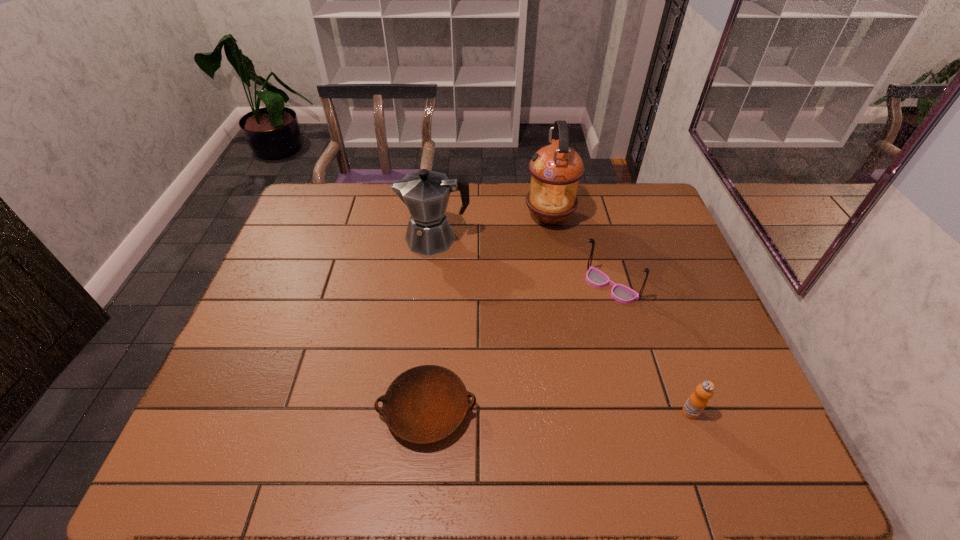
Locate an element on the screen. vacant space at the left edge is located at coordinates (294, 282).

The width and height of the screenshot is (960, 540). What are the coordinates of `free space at the right edge of the desktop` in the screenshot? It's located at (651, 275).

Locate an element on the screen. This screenshot has width=960, height=540. vacant point at the far left corner is located at coordinates (336, 187).

Find the location of a particular element. The image size is (960, 540). free space at the near left corner of the desktop is located at coordinates (192, 460).

In the image, there is a desktop. Where is `vacant space at the far right corner`? vacant space at the far right corner is located at coordinates (623, 201).

You are a GUI agent. You are given a task and a screenshot of the screen. Output one action in this format:
    pyautogui.click(x=<x>, y=<y>)
    Task: Click on the blank region between the shortest object and the third farthest object
    
    Given the screenshot: What is the action you would take?
    pyautogui.click(x=518, y=348)

Locate an element on the screen. This screenshot has height=540, width=960. free space between the spectacles and the tallest object is located at coordinates (580, 252).

Find the location of a particular element. vacant area between the second shortest object and the plate is located at coordinates (559, 411).

At what (x,y) coordinates should I click in order to perform the action: click on free area in between the oil lamp and the third nearest object. Please return your answer as a coordinate pair (x, y). The width and height of the screenshot is (960, 540). Looking at the image, I should click on (580, 252).

Identify the location of vacant point located between the shortest object and the oil lamp. (489, 314).